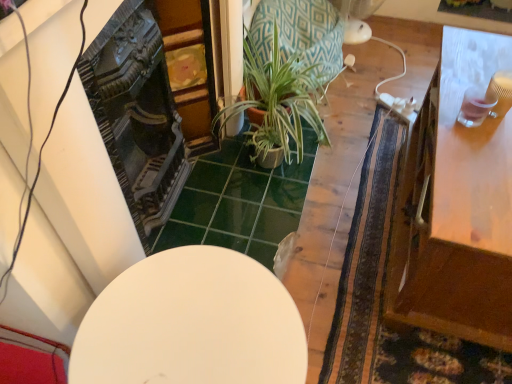
Describe the element at coordinates (457, 205) in the screenshot. I see `wooden table at right, marked as the second table in a left-to-right arrangement` at that location.

Locate an element on the screen. white matte table at center, which ranks as the first table in left-to-right order is located at coordinates (192, 324).

Is wooden table at right, the first table from the right, shorter than green textured pot at center?

In fact, wooden table at right, the first table from the right, may be taller than green textured pot at center.

From the image's perspective, which object appears higher, wooden table at right, the first table from the right, or green textured pot at center?

From the image's view, green textured pot at center is above.

Is point (449, 259) closer to viewer compared to point (278, 141)?

That is True.

Between wooden table at right, the first table from the right, and green textured pot at center, which one has larger size?

With larger size is wooden table at right, the first table from the right.

Is white matte table at center, which ranks as the first table in left-to-right order, next to wooden table at right, the first table from the right, and touching it?

No, white matte table at center, which ranks as the first table in left-to-right order, is not beside wooden table at right, the first table from the right.

Looking at their sizes, would you say white matte table at center, which ranks as the first table in left-to-right order, is wider or thinner than wooden table at right, marked as the second table in a left-to-right arrangement?

Clearly, white matte table at center, which ranks as the first table in left-to-right order, has less width compared to wooden table at right, marked as the second table in a left-to-right arrangement.

What's the angular difference between white matte table at center, which ranks as the first table in left-to-right order, and wooden table at right, the first table from the right,'s facing directions?

A: There is a 89.8-degree angle between the facing directions of white matte table at center, which ranks as the first table in left-to-right order, and wooden table at right, the first table from the right.

Considering the positions of points (256, 341) and (412, 307), is point (256, 341) closer to camera compared to point (412, 307)?

Yes, point (256, 341) is in front of point (412, 307).

Is white matte table at center, the second table positioned from the right, facing away from green textured pot at center?

That's not correct — white matte table at center, the second table positioned from the right, is not looking away from green textured pot at center.

From the image's perspective, is white matte table at center, which ranks as the first table in left-to-right order, positioned above or below green textured pot at center?

white matte table at center, which ranks as the first table in left-to-right order, is situated lower than green textured pot at center in the image.

Is point (99, 351) more distant than point (297, 137)?

No, (99, 351) is closer to viewer.

Considering the relative sizes of green textured pot at center and white matte table at center, the second table positioned from the right, in the image provided, is green textured pot at center smaller than white matte table at center, the second table positioned from the right,?

A: No.

Which is in front, point (295, 124) or point (247, 366)?

Positioned in front is point (247, 366).

From the image's perspective, is green textured pot at center located above or below white matte table at center, which ranks as the first table in left-to-right order?

Clearly, from the image's perspective, green textured pot at center is above white matte table at center, which ranks as the first table in left-to-right order.

Would you say green textured pot at center is inside or outside white matte table at center, which ranks as the first table in left-to-right order?

The correct answer is: outside.

Could you tell me if green textured pot at center is facing wooden table at right, marked as the second table in a left-to-right arrangement?

Yes, green textured pot at center faces towards wooden table at right, marked as the second table in a left-to-right arrangement.

How many degrees apart are the facing directions of green textured pot at center and wooden table at right, marked as the second table in a left-to-right arrangement?

The facing directions of green textured pot at center and wooden table at right, marked as the second table in a left-to-right arrangement, are 87.3 degrees apart.

Between green textured pot at center and wooden table at right, marked as the second table in a left-to-right arrangement, which one has larger width?

With larger width is wooden table at right, marked as the second table in a left-to-right arrangement.

From the image's perspective, which one is positioned higher, green textured pot at center or wooden table at right, the first table from the right?

green textured pot at center, from the image's perspective.

How many degrees apart are the facing directions of wooden table at right, marked as the second table in a left-to-right arrangement, and white matte table at center, which ranks as the first table in left-to-right order?

There is a 89.8-degree angle between the facing directions of wooden table at right, marked as the second table in a left-to-right arrangement, and white matte table at center, which ranks as the first table in left-to-right order.

Is wooden table at right, marked as the second table in a left-to-right arrangement, aimed at white matte table at center, the second table positioned from the right?

No, wooden table at right, marked as the second table in a left-to-right arrangement, does not turn towards white matte table at center, the second table positioned from the right.

Is wooden table at right, marked as the second table in a left-to-right arrangement, shorter than white matte table at center, which ranks as the first table in left-to-right order?

No, wooden table at right, marked as the second table in a left-to-right arrangement, is not shorter than white matte table at center, which ranks as the first table in left-to-right order.

From the green textured pot at center, count 1st tables forward and point to it. Please provide its 2D coordinates.

[(457, 205)]

The width and height of the screenshot is (512, 384). I want to click on table behind the white matte table at center, which ranks as the first table in left-to-right order, so click(x=457, y=205).

When comparing their distances from wooden table at right, the first table from the right, does white matte table at center, the second table positioned from the right, or green textured pot at center seem closer?

white matte table at center, the second table positioned from the right, lies closer to wooden table at right, the first table from the right, than the other object.

Estimate the real-world distances between objects in this image. Which object is further from white matte table at center, which ranks as the first table in left-to-right order, green textured pot at center or wooden table at right, the first table from the right?

green textured pot at center.

Which object lies further to the anchor point green textured pot at center, wooden table at right, marked as the second table in a left-to-right arrangement, or white matte table at center, the second table positioned from the right?

white matte table at center, the second table positioned from the right, is further to green textured pot at center.

When comparing their distances from white matte table at center, the second table positioned from the right, does wooden table at right, the first table from the right, or green textured pot at center seem closer?

The object closer to white matte table at center, the second table positioned from the right, is wooden table at right, the first table from the right.

Based on their spatial positions, is green textured pot at center or white matte table at center, which ranks as the first table in left-to-right order, further from wooden table at right, the first table from the right?

Based on the image, green textured pot at center appears to be further to wooden table at right, the first table from the right.

From the image, which object appears to be farther from green textured pot at center, white matte table at center, which ranks as the first table in left-to-right order, or wooden table at right, the first table from the right?

white matte table at center, which ranks as the first table in left-to-right order, is further to green textured pot at center.

At what (x,y) coordinates should I click in order to perform the action: click on houseplant between white matte table at center, which ranks as the first table in left-to-right order, and wooden table at right, marked as the second table in a left-to-right arrangement. Please return your answer as a coordinate pair (x, y). Looking at the image, I should click on (278, 101).